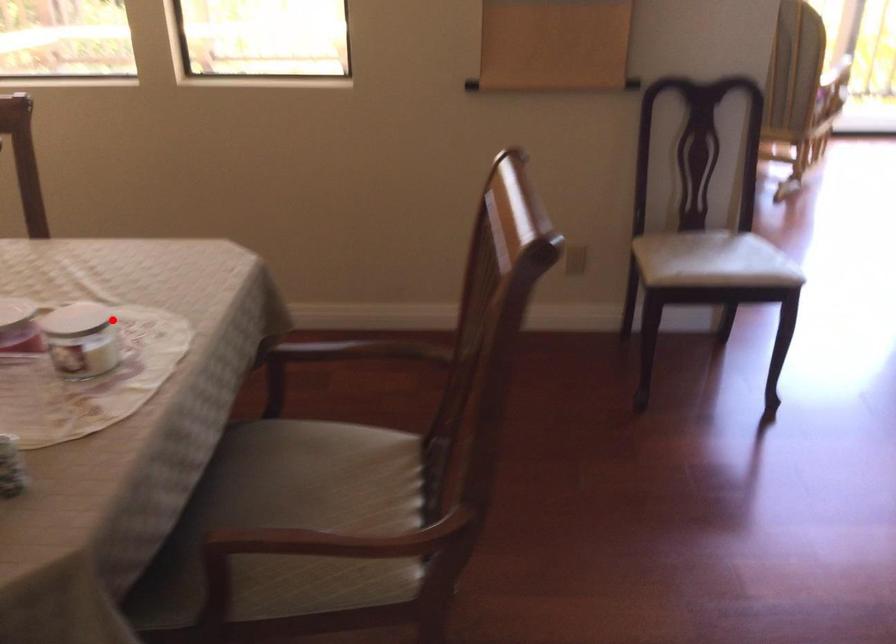
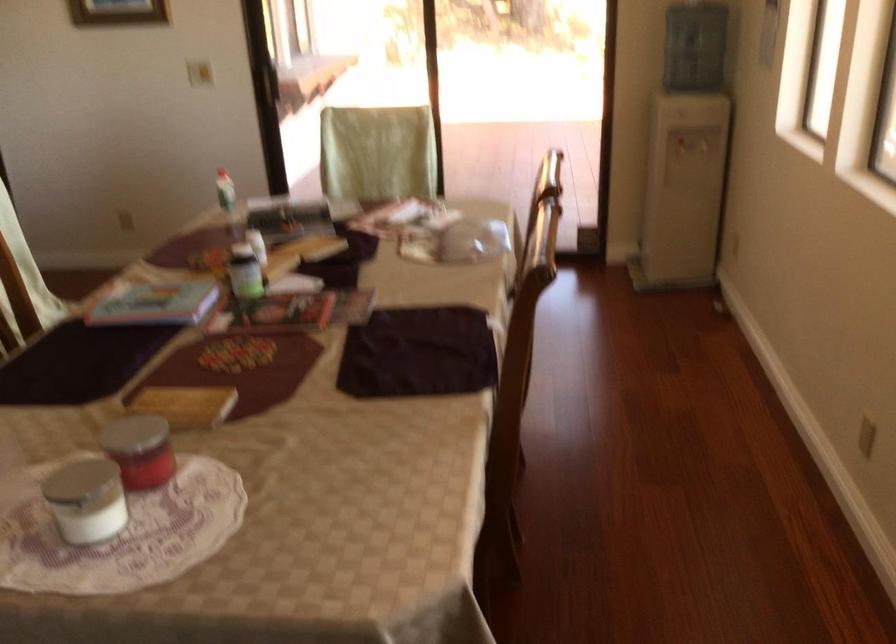
Question: I am providing you with two images of the same scene from different viewpoints. A red point is shown in image1. For the corresponding object point in image2, is it positioned nearer or farther from the camera?

Choices:
 (A) Nearer
 (B) Farther

Answer: (A)